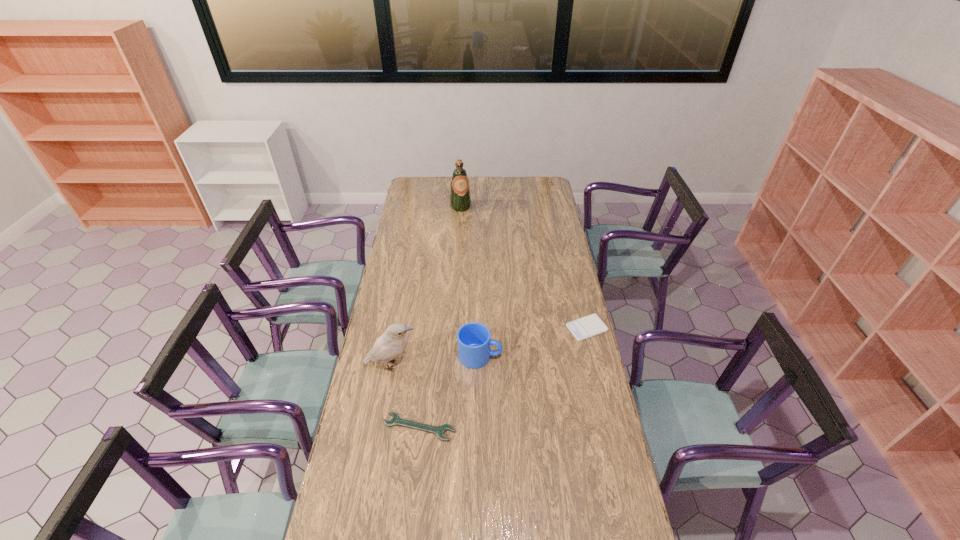
Identify the location of object situated at the right edge. The width and height of the screenshot is (960, 540). (583, 328).

The height and width of the screenshot is (540, 960). I want to click on vacant space at the far edge, so click(x=487, y=186).

Locate an element on the screen. blank area at the left edge is located at coordinates (405, 237).

Locate an element on the screen. This screenshot has width=960, height=540. vacant space at the right edge of the desktop is located at coordinates (604, 430).

The width and height of the screenshot is (960, 540). I want to click on vacant space at the far right corner of the desktop, so click(x=548, y=177).

I want to click on vacant space that is in between the mug and the calculator, so click(534, 342).

You are a GUI agent. You are given a task and a screenshot of the screen. Output one action in this format:
    pyautogui.click(x=<x>, y=<y>)
    Task: Click on the free space between the mug and the nearest object
    The image size is (960, 540).
    Given the screenshot: What is the action you would take?
    pyautogui.click(x=449, y=392)

Locate an element on the screen. unoccupied area between the fourth nearest object and the farthest object is located at coordinates (524, 267).

You are a GUI agent. You are given a task and a screenshot of the screen. Output one action in this format:
    pyautogui.click(x=<x>, y=<y>)
    Task: Click on the vacant space that's between the rightmost object and the tallest object
    The width and height of the screenshot is (960, 540).
    Given the screenshot: What is the action you would take?
    pyautogui.click(x=524, y=267)

This screenshot has height=540, width=960. I want to click on free space between the third shortest object and the calculator, so click(534, 342).